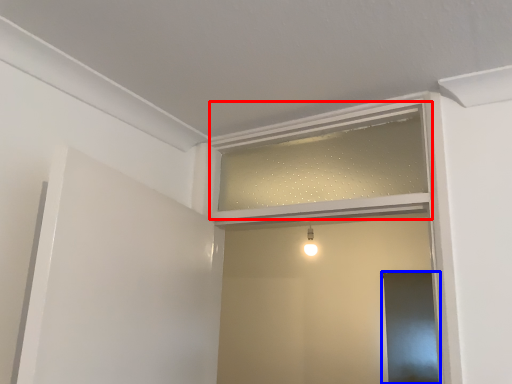
Question: Which of the following is the closest to the observer, window frame (highlighted by a red box) or screen door (highlighted by a blue box)?

Choices:
 (A) window frame
 (B) screen door

Answer: (A)